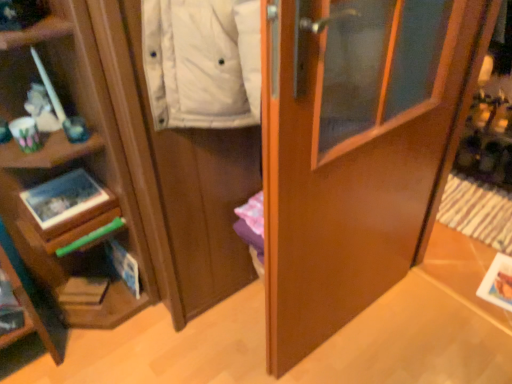
The image size is (512, 384). What are the coordinates of `matte wood cabinet at left` in the screenshot? It's located at (178, 177).

Identify the location of matte wood cabinet at left. (178, 177).

Is glossy wood door at center far away from matte wood cabinet at left?

No.

Where is `cabinetry below the glossy wood door at center (from a real-world perspective)`? Image resolution: width=512 pixels, height=384 pixels. cabinetry below the glossy wood door at center (from a real-world perspective) is located at coordinates (178, 177).

Considering the relative sizes of glossy wood door at center and matte wood cabinet at left in the image provided, is glossy wood door at center bigger than matte wood cabinet at left?

No.

Is glossy wood door at center looking in the opposite direction of matte wood cabinet at left?

Yes, glossy wood door at center is positioned with its back facing matte wood cabinet at left.

Does point (109, 73) lie behind point (347, 239)?

No, it is in front of (347, 239).

Which object is positioned more to the left, matte wood cabinet at left or glossy wood door at center?

matte wood cabinet at left is more to the left.

Is matte wood cabinet at left taller or shorter than glossy wood door at center?

Considering their sizes, matte wood cabinet at left has less height than glossy wood door at center.

Considering the sizes of objects matte cardboard magazine at lower left and matte wood cabinet at left in the image provided, who is thinner, matte cardboard magazine at lower left or matte wood cabinet at left?

matte cardboard magazine at lower left.

Is point (88, 305) more distant than point (254, 179)?

Yes, point (88, 305) is behind point (254, 179).

Who is shorter, matte cardboard magazine at lower left or matte wood cabinet at left?

matte cardboard magazine at lower left is shorter.

Are matte cardboard magazine at lower left and matte wood cabinet at left beside each other?

matte cardboard magazine at lower left and matte wood cabinet at left are not in contact.

Is glossy wood door at center facing away from matte cardboard magazine at lower left?

glossy wood door at center does not have its back to matte cardboard magazine at lower left.

Relative to matte cardboard magazine at lower left, is glossy wood door at center in front or behind?

Visually, glossy wood door at center is located in front of matte cardboard magazine at lower left.

Considering the relative sizes of glossy wood door at center and matte cardboard magazine at lower left in the image provided, is glossy wood door at center shorter than matte cardboard magazine at lower left?

In fact, glossy wood door at center may be taller than matte cardboard magazine at lower left.

Does glossy wood door at center contain matte cardboard magazine at lower left?

No, matte cardboard magazine at lower left is not a part of glossy wood door at center.

Considering the positions of point (129, 88) and point (62, 295), is point (129, 88) closer or farther from the camera than point (62, 295)?

Clearly, point (129, 88) is closer to the camera than point (62, 295).

Between matte wood cabinet at left and matte cardboard magazine at lower left, which one appears on the left side from the viewer's perspective?

matte cardboard magazine at lower left.

What are the coordinates of `magazine that is below the matte wood cabinet at left (from the image's perspective)` in the screenshot? It's located at (82, 291).

Can you confirm if matte wood cabinet at left is smaller than matte cardboard magazine at lower left?

No.

From the image's perspective, is matte cardboard magazine at lower left located above glossy wood door at center?

Actually, matte cardboard magazine at lower left appears below glossy wood door at center in the image.

Which of these two, matte cardboard magazine at lower left or glossy wood door at center, is smaller?

With smaller size is matte cardboard magazine at lower left.

Locate an element on the screen. The width and height of the screenshot is (512, 384). magazine on the left side of glossy wood door at center is located at coordinates (82, 291).

Can you tell me how much matte cardboard magazine at lower left and glossy wood door at center differ in facing direction?

The facing directions of matte cardboard magazine at lower left and glossy wood door at center are 40.5 degrees apart.

Locate an element on the screen. This screenshot has width=512, height=384. cabinetry below the glossy wood door at center (from a real-world perspective) is located at coordinates (178, 177).

At what (x,y) coordinates should I click in order to perform the action: click on door that appears below the matte wood cabinet at left (from the image's perspective). Please return your answer as a coordinate pair (x, y). The height and width of the screenshot is (384, 512). Looking at the image, I should click on tap(356, 150).

When comparing their distances from matte cardboard magazine at lower left, does glossy wood door at center or matte wood cabinet at left seem further?

The object further to matte cardboard magazine at lower left is glossy wood door at center.

Estimate the real-world distances between objects in this image. Which object is closer to matte cardboard magazine at lower left, matte wood cabinet at left or glossy wood door at center?

matte wood cabinet at left is positioned closer to the anchor matte cardboard magazine at lower left.

When comparing their distances from matte wood cabinet at left, does glossy wood door at center or matte cardboard magazine at lower left seem closer?

glossy wood door at center.

Based on their spatial positions, is matte cardboard magazine at lower left or glossy wood door at center further from matte wood cabinet at left?

Among the two, matte cardboard magazine at lower left is located further to matte wood cabinet at left.

From the image, which object appears to be farther from glossy wood door at center, matte cardboard magazine at lower left or matte wood cabinet at left?

Based on the image, matte cardboard magazine at lower left appears to be further to glossy wood door at center.

Estimate the real-world distances between objects in this image. Which object is closer to glossy wood door at center, matte wood cabinet at left or matte cardboard magazine at lower left?

The object closer to glossy wood door at center is matte wood cabinet at left.

At what (x,y) coordinates should I click in order to perform the action: click on cabinetry between matte cardboard magazine at lower left and glossy wood door at center in the horizontal direction. Please return your answer as a coordinate pair (x, y). Looking at the image, I should click on (178, 177).